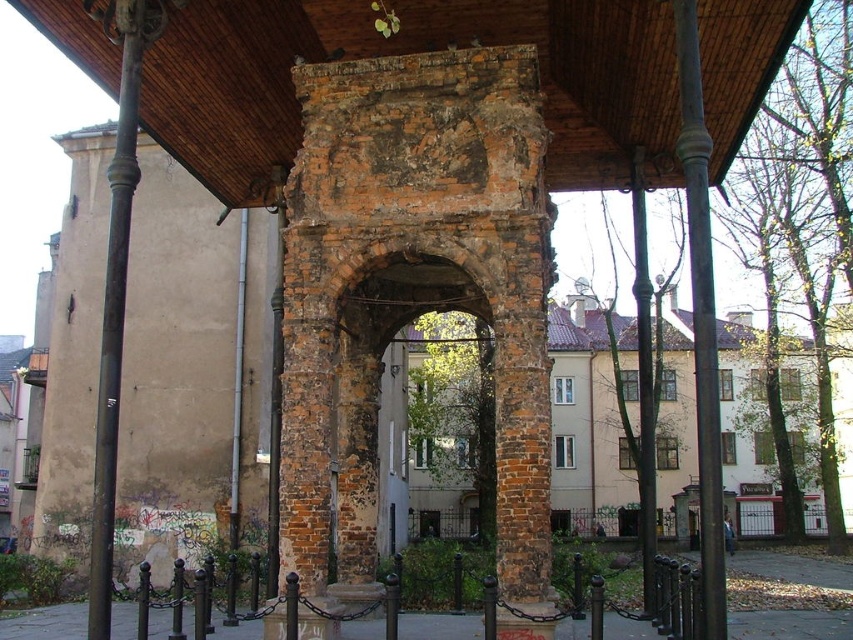
Does smooth dark brown post at right have a greater width compared to green metallic pole at center?

Indeed, smooth dark brown post at right has a greater width compared to green metallic pole at center.

Does smooth dark brown post at right appear on the right side of green metallic pole at center?

Indeed, smooth dark brown post at right is positioned on the right side of green metallic pole at center.

What are the coordinates of `smooth dark brown post at right` in the screenshot? It's located at (701, 316).

At what (x,y) coordinates should I click in order to perform the action: click on smooth dark brown post at right. Please return your answer as a coordinate pair (x, y). The height and width of the screenshot is (640, 853). Looking at the image, I should click on (701, 316).

Is wooden at center smaller than smooth dark brown post at right?

Correct, wooden at center occupies less space than smooth dark brown post at right.

Is wooden at center below smooth dark brown post at right?

Incorrect, wooden at center is not positioned below smooth dark brown post at right.

Between point (355, 40) and point (686, 176), which one is positioned in front?

Positioned in front is point (686, 176).

Locate an element on the screen. This screenshot has height=640, width=853. wooden at center is located at coordinates click(405, 52).

Is black polished pole at left behind green metallic pole at center?

No.

Who is more distant from viewer, (100, 365) or (648, 513)?

The point (648, 513) is behind.

The width and height of the screenshot is (853, 640). I want to click on black polished pole at left, so click(114, 300).